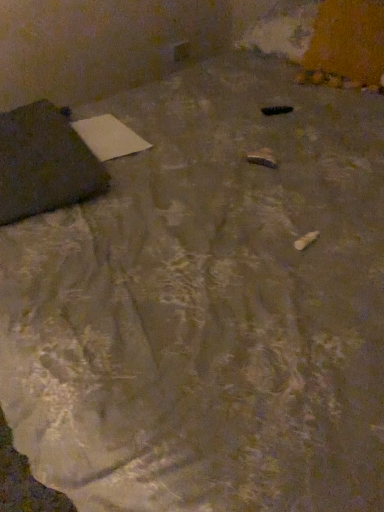
This screenshot has height=512, width=384. In order to click on free space above white paper at upper left (from a real-world perspective) in this screenshot , I will do `click(100, 132)`.